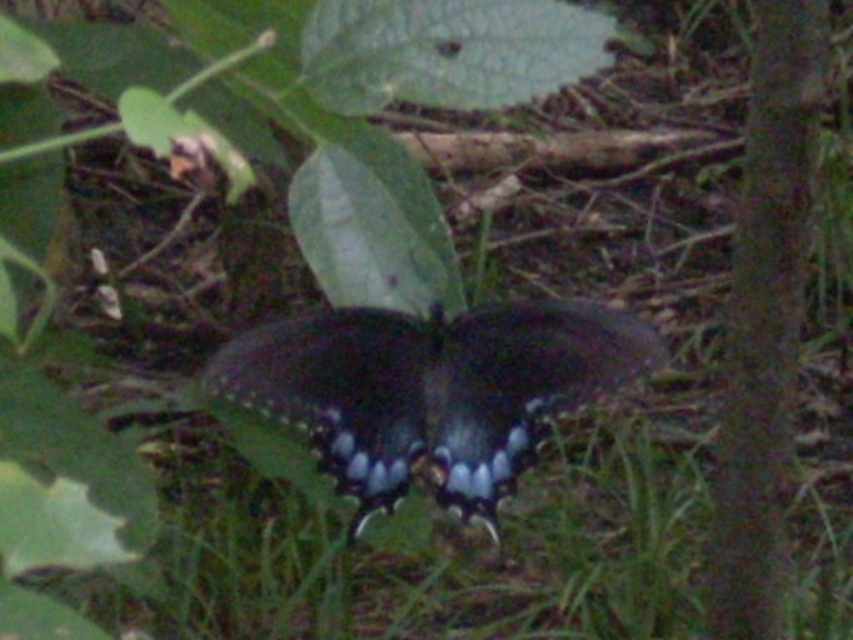
What do you see at coordinates (425, 554) in the screenshot? I see `green grass at lower center` at bounding box center [425, 554].

Is point (235, 445) positioned after point (229, 380)?

That is True.

Does point (656, 605) come in front of point (630, 380)?

No, (656, 605) is further to viewer.

Where is `green grass at lower center`? This screenshot has width=853, height=640. green grass at lower center is located at coordinates (425, 554).

Is point (407, 401) positioned in front of point (761, 531)?

Yes, it is.

Is the position of shiny blue butterfly at center less distant than that of smooth bark tree at right?

Yes, shiny blue butterfly at center is closer to the viewer.

Does point (502, 346) come behind point (752, 282)?

No, it is not.

In order to click on shiny blue butterfly at center in this screenshot , I will do `click(431, 390)`.

Does green grass at lower center have a greater height compared to smooth bark tree at right?

Incorrect, green grass at lower center's height is not larger of smooth bark tree at right's.

Can you confirm if green grass at lower center is shorter than smooth bark tree at right?

Indeed, green grass at lower center has a lesser height compared to smooth bark tree at right.

Between point (335, 561) and point (804, 38), which one is positioned behind?

The point (335, 561) is behind.

The width and height of the screenshot is (853, 640). I want to click on green grass at lower center, so click(x=425, y=554).